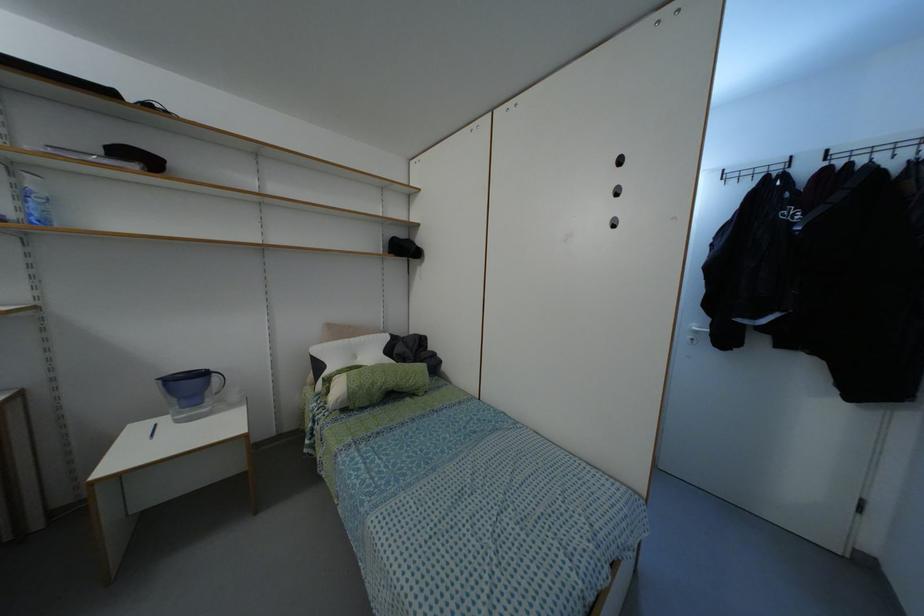
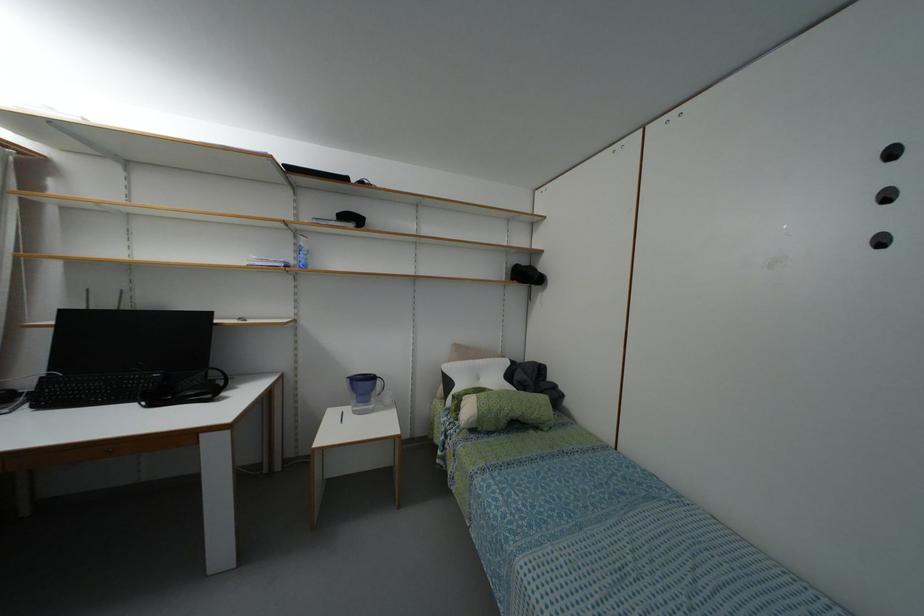
Question: The camera is either moving clockwise (left) or counter-clockwise (right) around the object. The first image is from the beginning of the video and the second image is from the end. Is the camera moving left or right when shooting the video?

Choices:
 (A) Left
 (B) Right

Answer: (B)